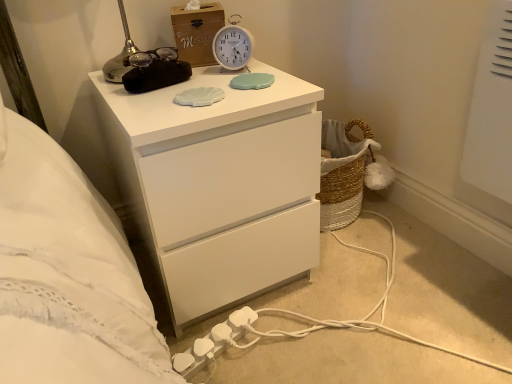
In order to click on free space in front of white plastic alarm clock at upper center in this screenshot , I will do `click(220, 87)`.